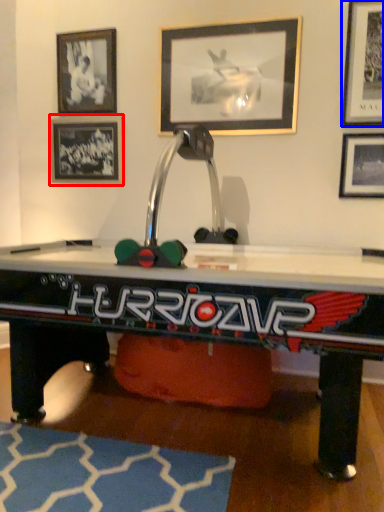
Question: Which of the following is the farthest to the observer, picture frame (highlighted by a red box) or picture frame (highlighted by a blue box)?

Choices:
 (A) picture frame
 (B) picture frame

Answer: (A)